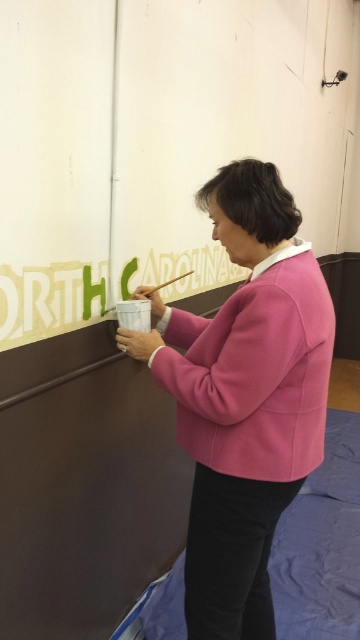
What are the coordinates of `matte pink sweatshirt at center` in the screenshot? It's located at (254, 371).

Does matte pink sweatshirt at center have a lesser width compared to wooden paintbrush at upper center?

Incorrect, matte pink sweatshirt at center's width is not less than wooden paintbrush at upper center's.

Which is behind, point (297, 252) or point (151, 292)?

Point (151, 292)

Locate an element on the screen. The image size is (360, 640). matte pink sweatshirt at center is located at coordinates (254, 371).

Does pink woolen sweater at center appear over wooden paintbrush at upper center?

Actually, pink woolen sweater at center is below wooden paintbrush at upper center.

Based on the photo, does pink woolen sweater at center have a greater height compared to wooden paintbrush at upper center?

Yes, pink woolen sweater at center is taller than wooden paintbrush at upper center.

Is point (284, 241) positioned in front of point (150, 292)?

Yes, it is in front of point (150, 292).

You are a GUI agent. You are given a task and a screenshot of the screen. Output one action in this format:
    pyautogui.click(x=<x>, y=<y>)
    Task: Click on the pink woolen sweater at center
    The image size is (360, 640).
    Given the screenshot: What is the action you would take?
    pyautogui.click(x=245, y=397)

Based on the photo, is pink woolen sweater at center above matte pink sweatshirt at center?

Incorrect, pink woolen sweater at center is not positioned above matte pink sweatshirt at center.

What do you see at coordinates (245, 397) in the screenshot? This screenshot has width=360, height=640. I see `pink woolen sweater at center` at bounding box center [245, 397].

What do you see at coordinates (245, 397) in the screenshot?
I see `pink woolen sweater at center` at bounding box center [245, 397].

This screenshot has height=640, width=360. I want to click on pink woolen sweater at center, so click(x=245, y=397).